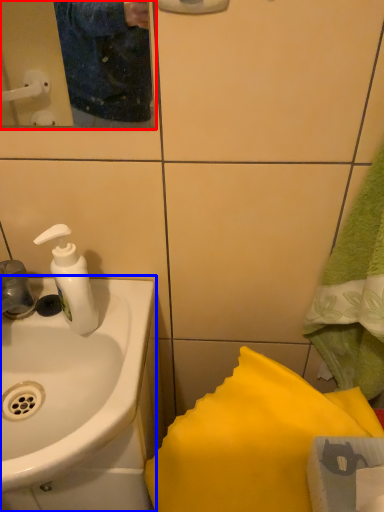
Question: Which of the following is the farthest to the observer, mirror (highlighted by a red box) or sink (highlighted by a blue box)?

Choices:
 (A) mirror
 (B) sink

Answer: (B)